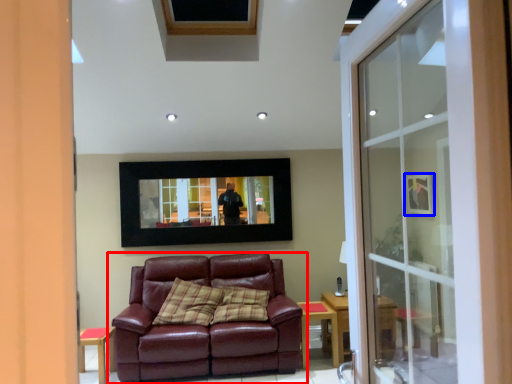
Question: Among these objects, which one is nearest to the camera, studio couch (highlighted by a red box) or picture frame (highlighted by a blue box)?

Choices:
 (A) studio couch
 (B) picture frame

Answer: (A)